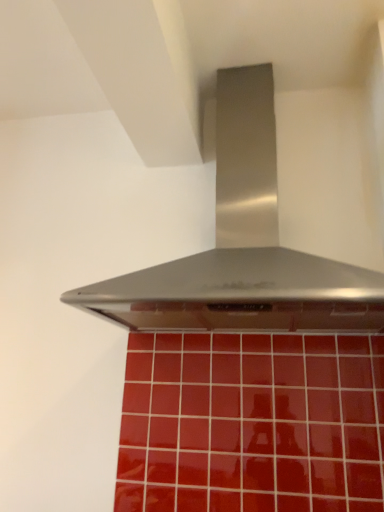
Where is `stainless steel range hood at center`? Image resolution: width=384 pixels, height=512 pixels. stainless steel range hood at center is located at coordinates (243, 246).

Image resolution: width=384 pixels, height=512 pixels. What do you see at coordinates (243, 246) in the screenshot?
I see `stainless steel range hood at center` at bounding box center [243, 246].

Identify the location of stainless steel range hood at center. (243, 246).